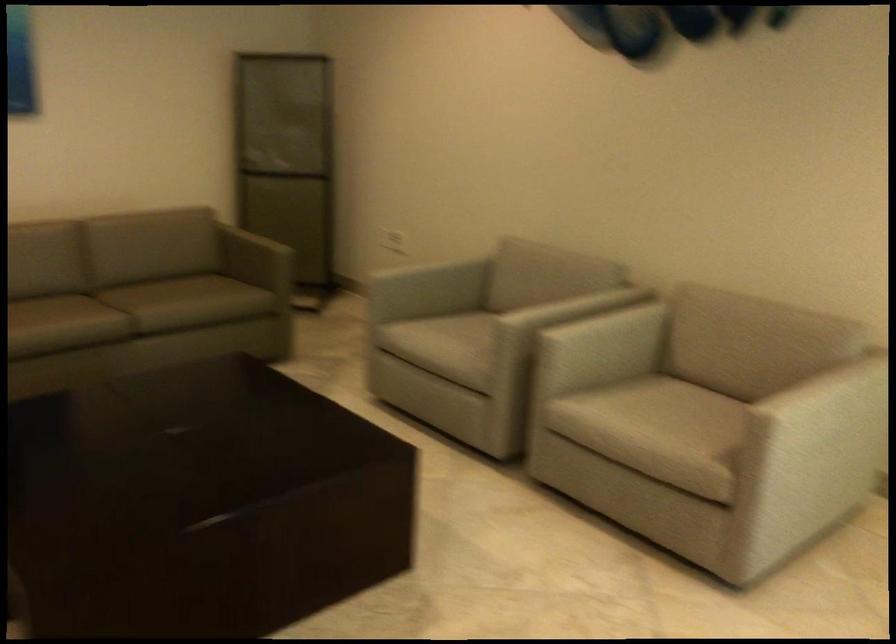
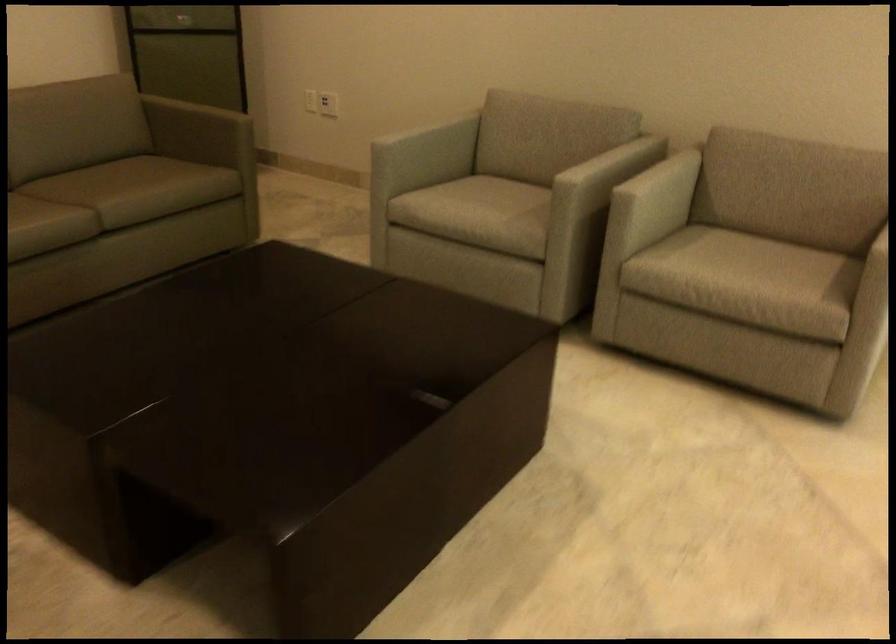
The point at (312, 243) is marked in the first image. Where is the corresponding point in the second image?

(227, 114)